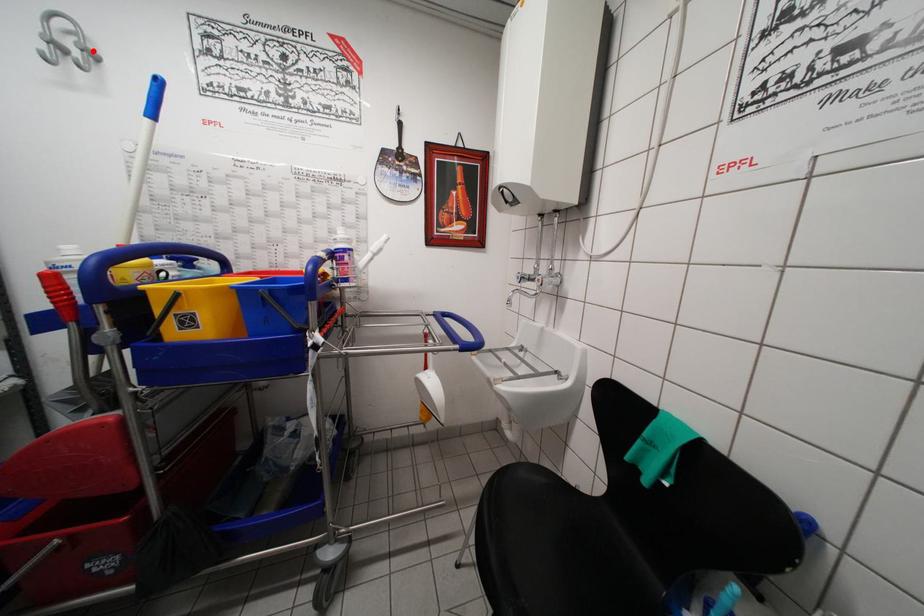
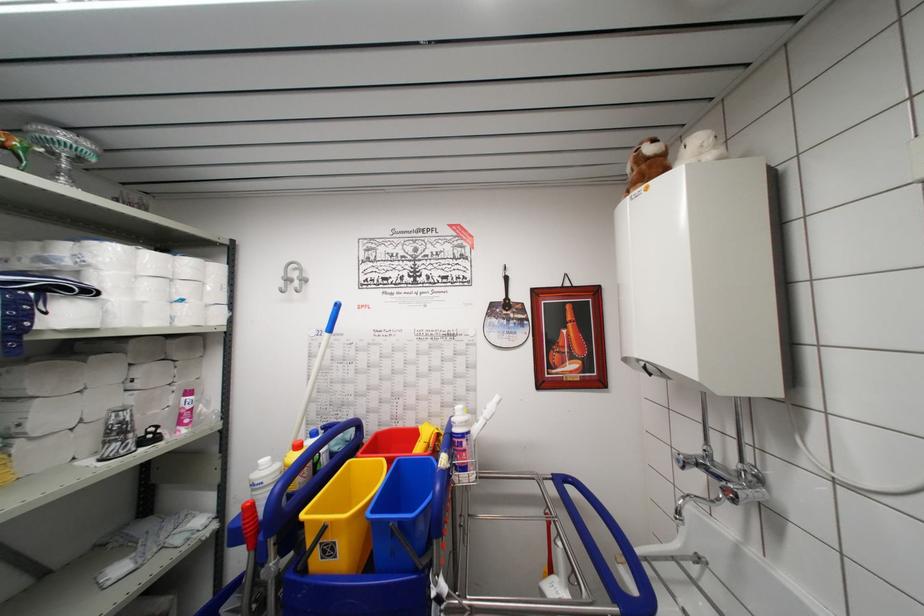
The point at the highlighted location is marked in the first image. Where is the corresponding point in the second image?

(307, 280)